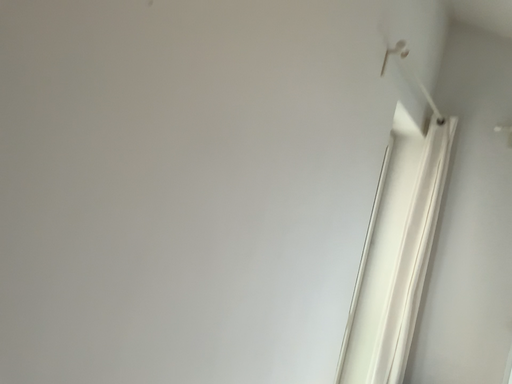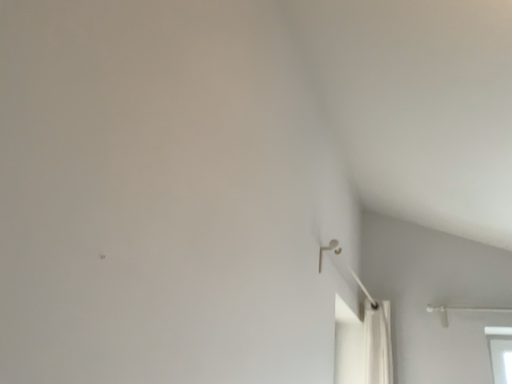
Question: How did the camera likely rotate when shooting the video?

Choices:
 (A) rotated downward
 (B) rotated upward

Answer: (B)